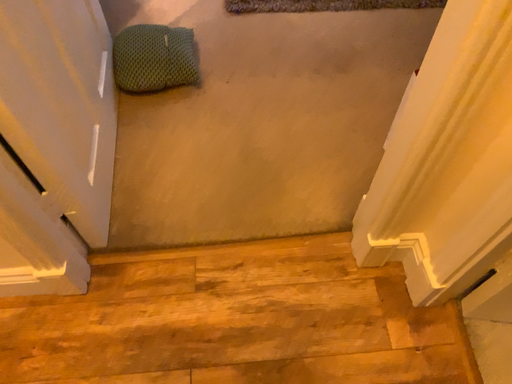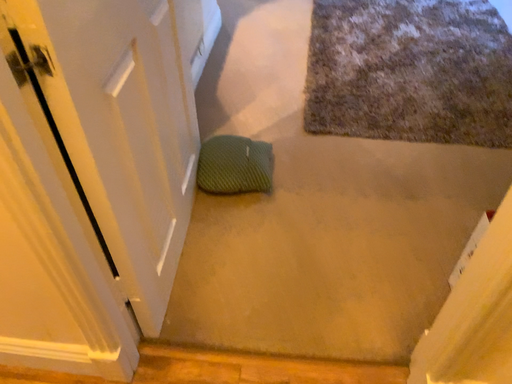
Question: Which way did the camera rotate in the video?

Choices:
 (A) rotated right
 (B) rotated left

Answer: (B)